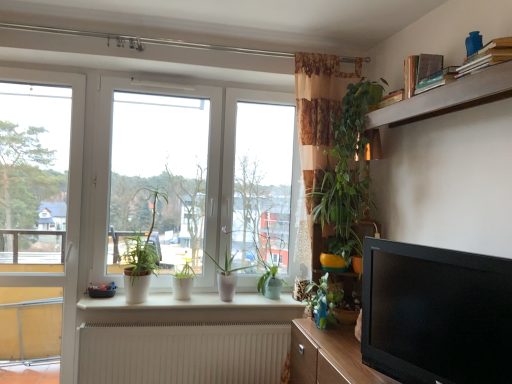
The image size is (512, 384). Describe the element at coordinates (183, 353) in the screenshot. I see `beige textured radiator at lower center` at that location.

Identify the location of beige textured radiator at lower center. (183, 353).

Measure the distance between point (187, 294) and camera.

They are 2.72 meters apart.

The height and width of the screenshot is (384, 512). I want to click on wooden shelf at upper right, which appears as the first shelf when viewed from the front, so click(448, 98).

In the scene shown: What is the approximate width of green matte plant at center, marked as the 5th houseplant in a right-to-left arrangement?

It is 11.19 inches.

Where is `green matte plant at center, marked as the 5th houseplant in a right-to-left arrangement`? The image size is (512, 384). green matte plant at center, marked as the 5th houseplant in a right-to-left arrangement is located at coordinates (142, 256).

I want to click on beige textured radiator at lower center, so click(x=183, y=353).

Is white matte pot at window, placed as the 3th houseplant when sorted from left to right, inside or outside of white plastic door at left?

white matte pot at window, placed as the 3th houseplant when sorted from left to right, is located beyond the bounds of white plastic door at left.

Between white matte pot at window, placed as the 3th houseplant when sorted from left to right, and white plastic door at left, which one has smaller size?

Smaller between the two is white matte pot at window, placed as the 3th houseplant when sorted from left to right.

From the image's perspective, who appears lower, white matte pot at window, which appears as the 3th houseplant when viewed from the right, or white plastic door at left?

white matte pot at window, which appears as the 3th houseplant when viewed from the right.

Relative to blue glossy houseplant at lower center, which is the second houseplant from right to left, is white glossy window at center in front or behind?

white glossy window at center is behind blue glossy houseplant at lower center, which is the second houseplant from right to left.

In terms of width, does white glossy window at center look wider or thinner when compared to blue glossy houseplant at lower center, which is the fourth houseplant from left to right?

In the image, white glossy window at center appears to be wider than blue glossy houseplant at lower center, which is the fourth houseplant from left to right.

In the scene shown: From a real-world perspective, relative to blue glossy houseplant at lower center, which is the second houseplant from right to left, is white glossy window at center vertically above or below?

white glossy window at center is situated higher than blue glossy houseplant at lower center, which is the second houseplant from right to left, in the real world.

Which of these two, white glossy window at center or blue glossy houseplant at lower center, which is the fourth houseplant from left to right, is smaller?

blue glossy houseplant at lower center, which is the fourth houseplant from left to right.

From a real-world perspective, is blue glossy houseplant at lower center, which is the second houseplant from right to left, below wooden cabinet at lower right?

Incorrect, from a real-world perspective, blue glossy houseplant at lower center, which is the second houseplant from right to left, is higher than wooden cabinet at lower right.

In the scene shown: Between blue glossy houseplant at lower center, which is the fourth houseplant from left to right, and wooden cabinet at lower right, which one has smaller size?

blue glossy houseplant at lower center, which is the fourth houseplant from left to right.

Where is `the 1st houseplant above the wooden cabinet at lower right (from a real-world perspective)`? the 1st houseplant above the wooden cabinet at lower right (from a real-world perspective) is located at coordinates (323, 300).

Do you think white glossy window at center is within white matte pot at window, placed as the 3th houseplant when sorted from left to right, or outside of it?

white glossy window at center lies outside white matte pot at window, placed as the 3th houseplant when sorted from left to right.

Considering the positions of objects white glossy window at center and white matte pot at window, placed as the 3th houseplant when sorted from left to right, in the image provided, who is behind, white glossy window at center or white matte pot at window, placed as the 3th houseplant when sorted from left to right,?

white matte pot at window, placed as the 3th houseplant when sorted from left to right.

Looking at this image, could you tell me if white glossy window at center is turned towards white matte pot at window, placed as the 3th houseplant when sorted from left to right?

Yes, white glossy window at center is facing white matte pot at window, placed as the 3th houseplant when sorted from left to right.

Between white glossy window at center and white matte pot at window, placed as the 3th houseplant when sorted from left to right, which one has larger size?

white glossy window at center is bigger.

Considering the relative sizes of green matte plant at center, marked as the 5th houseplant in a right-to-left arrangement, and green matte plant at center, the 2th houseplant from the left, in the image provided, is green matte plant at center, marked as the 5th houseplant in a right-to-left arrangement, thinner than green matte plant at center, the 2th houseplant from the left,?

Incorrect, the width of green matte plant at center, marked as the 5th houseplant in a right-to-left arrangement, is not less than that of green matte plant at center, the 2th houseplant from the left.

Does green matte plant at center, marked as the 5th houseplant in a right-to-left arrangement, have a smaller size compared to green matte plant at center, the 2th houseplant from the left?

Incorrect, green matte plant at center, marked as the 5th houseplant in a right-to-left arrangement, is not smaller in size than green matte plant at center, the 2th houseplant from the left.

From a real-world perspective, is green matte plant at center, marked as the 5th houseplant in a right-to-left arrangement, positioned above or below green matte plant at center, the 2th houseplant from the left?

Clearly, from a real-world perspective, green matte plant at center, marked as the 5th houseplant in a right-to-left arrangement, is above green matte plant at center, the 2th houseplant from the left.

From the image's perspective, starting from the green matte plant at center, marked as the 5th houseplant in a right-to-left arrangement, which houseplant is the 2nd one below? Please provide its 2D coordinates.

[(183, 281)]

Are green matte plant at center, the 2th houseplant from the left, and green leafy plant at upper center, which is counted as the 5th houseplant, starting from the left, making contact?

green matte plant at center, the 2th houseplant from the left, and green leafy plant at upper center, which is counted as the 5th houseplant, starting from the left, are clearly separated.

Find the location of a particular element. the 3rd houseplant above the green matte plant at center, the 2th houseplant from the left (from a real-world perspective) is located at coordinates (341, 161).

Do you think green matte plant at center, the 2th houseplant from the left, is within green leafy plant at upper center, which is counted as the 5th houseplant, starting from the left, or outside of it?

green matte plant at center, the 2th houseplant from the left, is spatially situated outside green leafy plant at upper center, which is counted as the 5th houseplant, starting from the left.

From the image's perspective, is white plastic door at left located above or below beige textured radiator at lower center?

Clearly, from the image's perspective, white plastic door at left is above beige textured radiator at lower center.

Is point (31, 198) closer or farther from the camera than point (121, 330)?

Point (31, 198) is farther from the camera than point (121, 330).

Can you confirm if white plastic door at left is taller than beige textured radiator at lower center?

Correct, white plastic door at left is much taller as beige textured radiator at lower center.

Who is bigger, white plastic door at left or beige textured radiator at lower center?

With larger size is white plastic door at left.

The width and height of the screenshot is (512, 384). What are the coordinates of `door above the white matte pot at window, placed as the 3th houseplant when sorted from left to right (from a real-world perspective)` in the screenshot? It's located at (40, 210).

This screenshot has width=512, height=384. I want to click on window above the blue glossy houseplant at lower center, which is the second houseplant from right to left (from the image's perspective), so click(x=203, y=180).

Looking at the image, which one is located closer to wooden textured shelf at right, the 2th shelf positioned from the top, white glossy window at center or green matte plant at center, which ranks as the fourth houseplant in right-to-left order?

white glossy window at center.

Based on the photo, from the image, which object appears to be farther from black glossy tv at lower right, wooden cabinet at lower right or wooden shelf at upper right, which appears as the first shelf when viewed from the front?

wooden shelf at upper right, which appears as the first shelf when viewed from the front, is further to black glossy tv at lower right.

Considering their positions, is white glossy window at center positioned closer to wooden shelf at upper right, which is counted as the first shelf, starting from the top, than beige textured radiator at lower center?

Among the two, white glossy window at center is located nearer to wooden shelf at upper right, which is counted as the first shelf, starting from the top.

Looking at the image, which one is located further to beige textured radiator at lower center, wooden cabinet at lower right or white plastic door at left?

white plastic door at left is further to beige textured radiator at lower center.

From the image, which object appears to be nearer to black glossy tv at lower right, green matte plant at center, placed as the first houseplant when sorted from left to right, or wooden textured shelf at right, placed as the first shelf when sorted from bottom to top?

Among the two, wooden textured shelf at right, placed as the first shelf when sorted from bottom to top, is located nearer to black glossy tv at lower right.

From the image, which object appears to be farther from green matte plant at center, which ranks as the fourth houseplant in right-to-left order, green leafy plant at upper center, which is counted as the 5th houseplant, starting from the left, or white matte pot at window, placed as the 3th houseplant when sorted from left to right?

green leafy plant at upper center, which is counted as the 5th houseplant, starting from the left, is further to green matte plant at center, which ranks as the fourth houseplant in right-to-left order.

From the image, which object appears to be nearer to green leafy plant at upper center, the 1th houseplant in the right-to-left sequence, blue glossy houseplant at lower center, which is the fourth houseplant from left to right, or white matte pot at window, which appears as the 3th houseplant when viewed from the right?

Among the two, blue glossy houseplant at lower center, which is the fourth houseplant from left to right, is located nearer to green leafy plant at upper center, the 1th houseplant in the right-to-left sequence.

Based on the photo, based on their spatial positions, is wooden cabinet at lower right or wooden shelf at upper right, the second shelf ordered from the bottom, closer to green matte plant at center, marked as the 5th houseplant in a right-to-left arrangement?

wooden cabinet at lower right.

Find the location of a particular element. Image resolution: width=512 pixels, height=384 pixels. cabinetry located between green matte plant at center, placed as the first houseplant when sorted from left to right, and black glossy tv at lower right in the left-right direction is located at coordinates (329, 357).

The image size is (512, 384). Find the location of `window between wooden shelf at upper right, the second shelf ordered from the bottom, and beige textured radiator at lower center, in the vertical direction`. window between wooden shelf at upper right, the second shelf ordered from the bottom, and beige textured radiator at lower center, in the vertical direction is located at coordinates (203, 180).

In order to click on radiator between black glossy tv at lower right and green matte plant at center, placed as the first houseplant when sorted from left to right, along the z-axis in this screenshot , I will do `click(183, 353)`.

Identify the location of television between wooden shelf at upper right, which is counted as the first shelf, starting from the top, and wooden cabinet at lower right vertically. Image resolution: width=512 pixels, height=384 pixels. (436, 314).